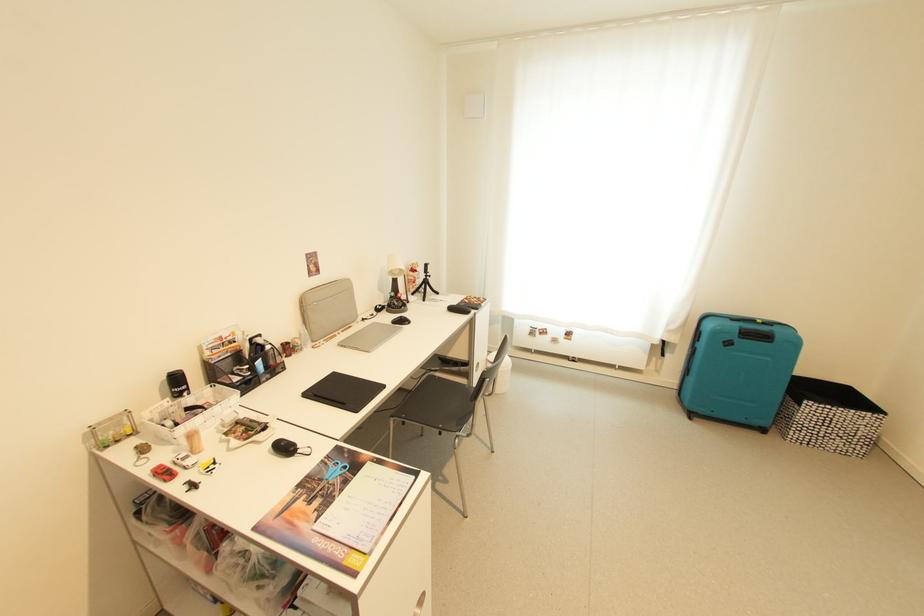
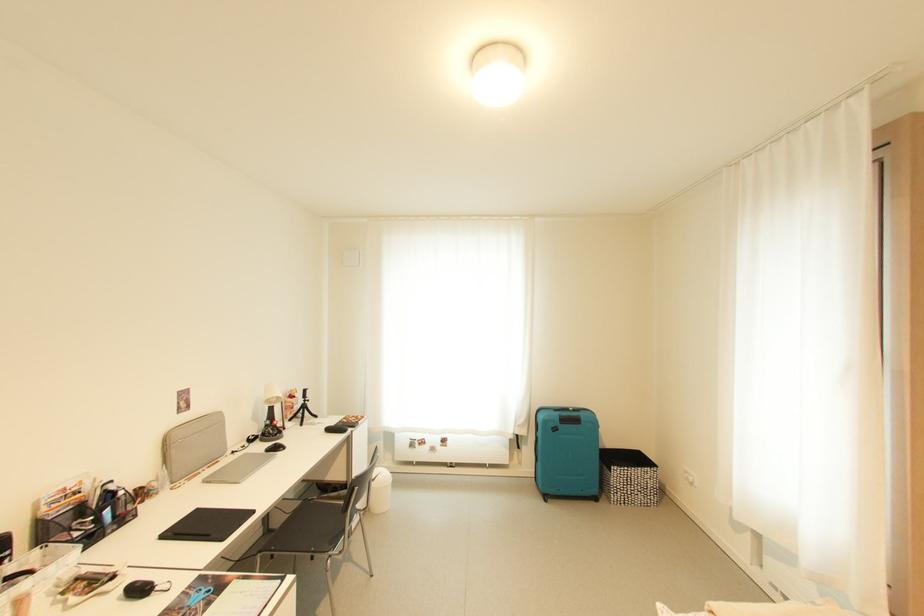
The point at (333,459) is marked in the first image. Where is the corresponding point in the second image?

(195, 589)